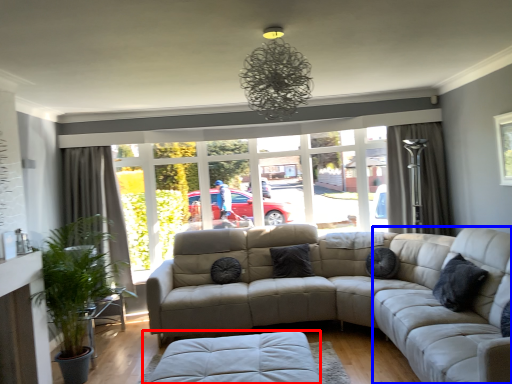
Question: Which point is closer to the camera, footrest (highlighted by a red box) or couch (highlighted by a blue box)?

Choices:
 (A) footrest
 (B) couch

Answer: (B)